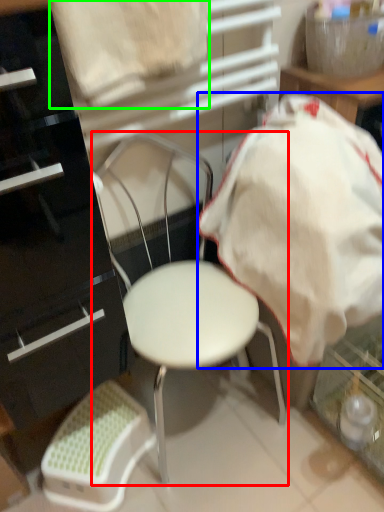
Question: Which is nearer to the chair (highlighted by a red box)? blanket (highlighted by a blue box) or sheet (highlighted by a green box).

Choices:
 (A) blanket
 (B) sheet

Answer: (A)